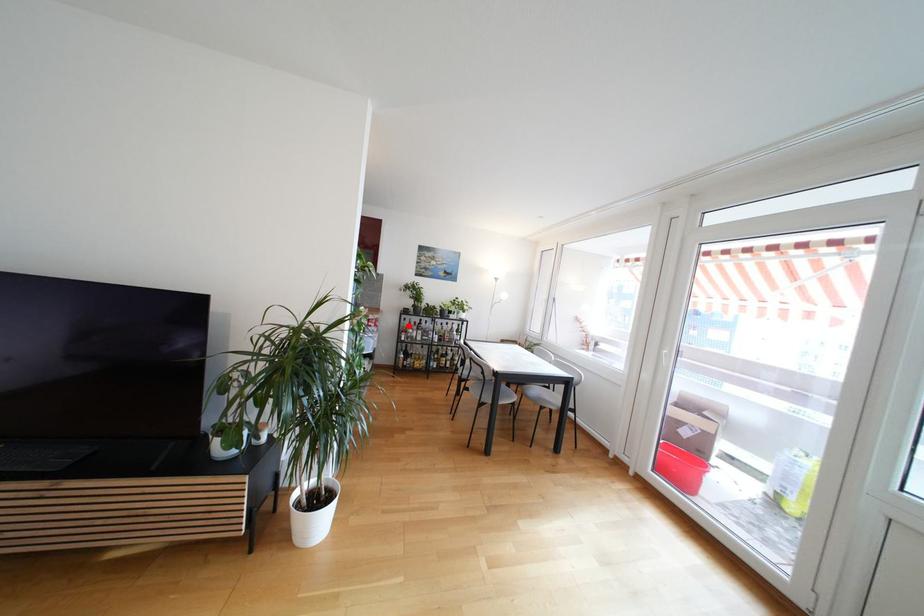
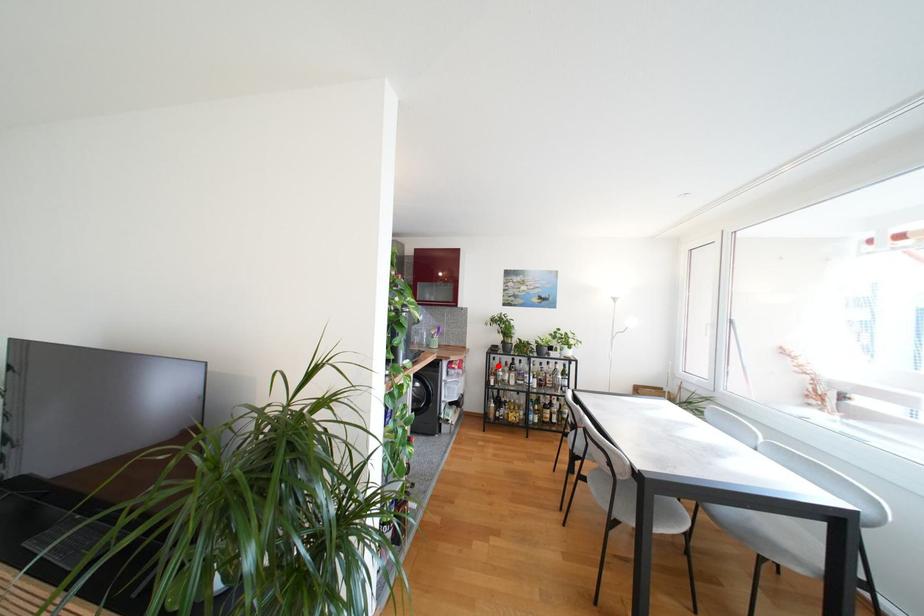
I am providing you with two images of the same scene from different viewpoints. A red point is marked on the first image and another point is marked on the second image. Do the highlighted points in image1 and image2 indicate the same real-world spot?

Yes